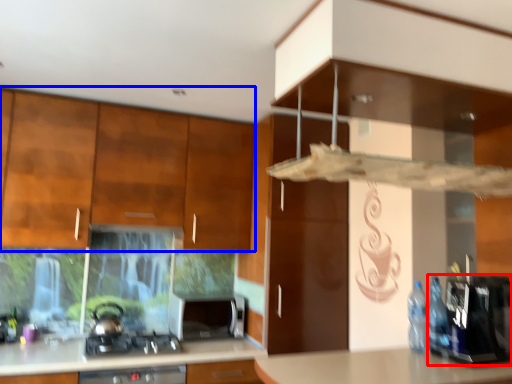
Question: Which object is further to the camera taking this photo, appliance (highlighted by a red box) or cabinetry (highlighted by a blue box)?

Choices:
 (A) appliance
 (B) cabinetry

Answer: (B)